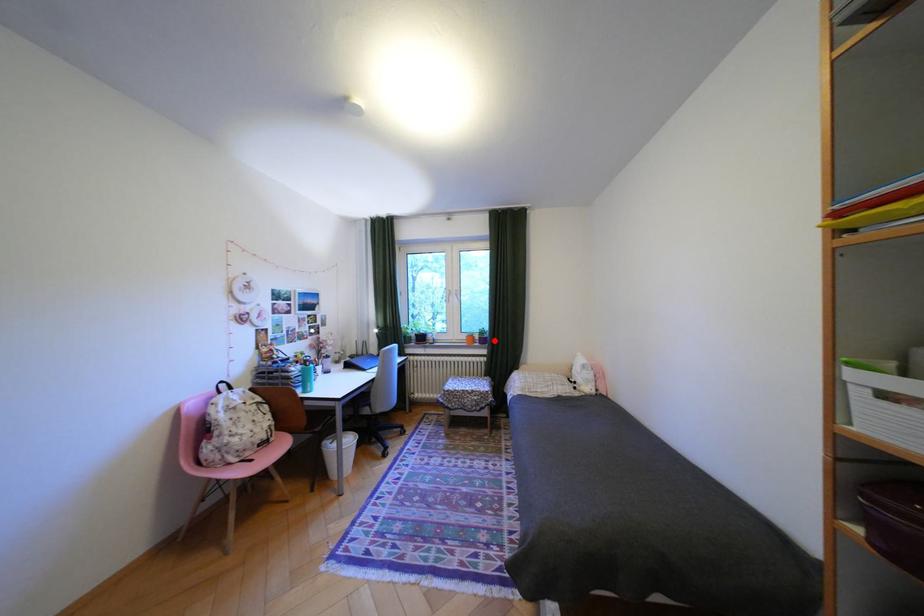
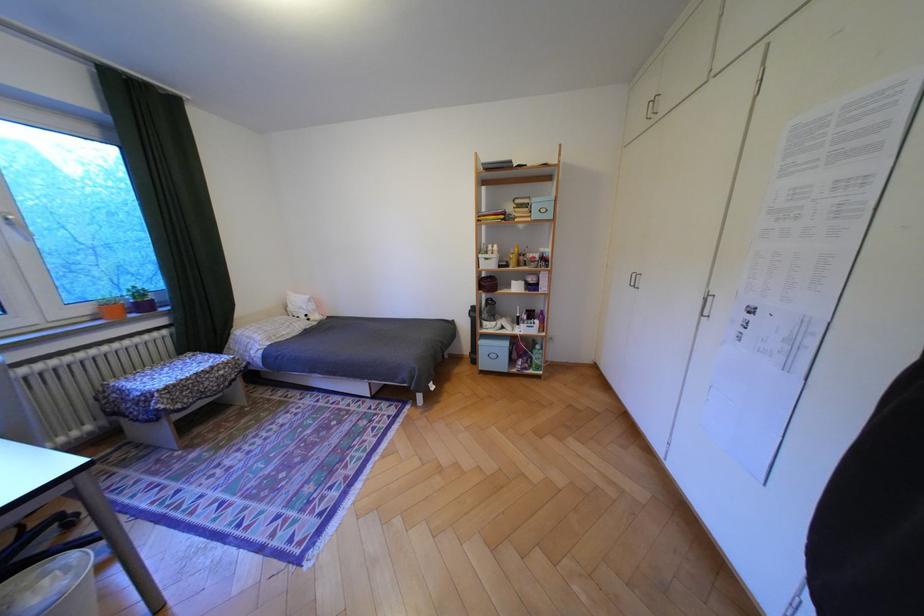
Question: I am providing you with two images of the same scene from different viewpoints. A red point is shown in image1. For the corresponding object point in image2, is it positioned nearer or farther from the camera?

Choices:
 (A) Nearer
 (B) Farther

Answer: (A)